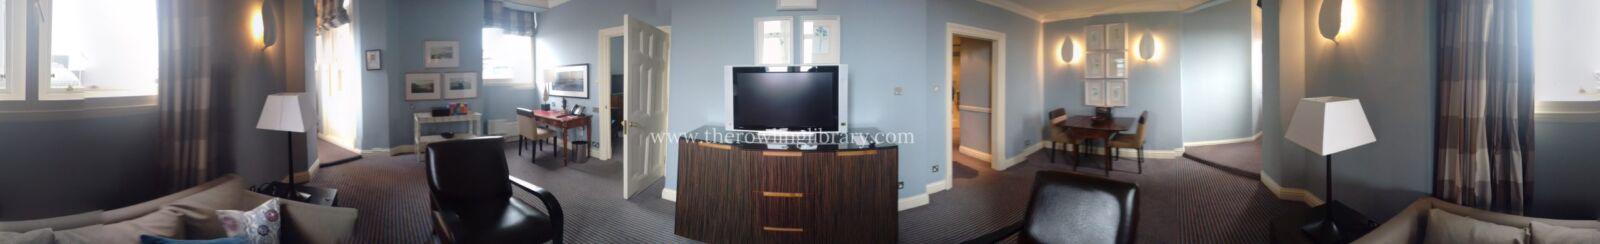
The image size is (1600, 244). What are the coordinates of `television` in the screenshot? It's located at (779, 92).